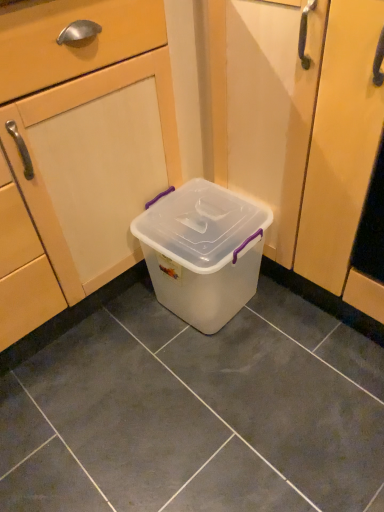
Locate an element on the screen. The width and height of the screenshot is (384, 512). vacant space to the right of transparent plastic storage box at center is located at coordinates (308, 324).